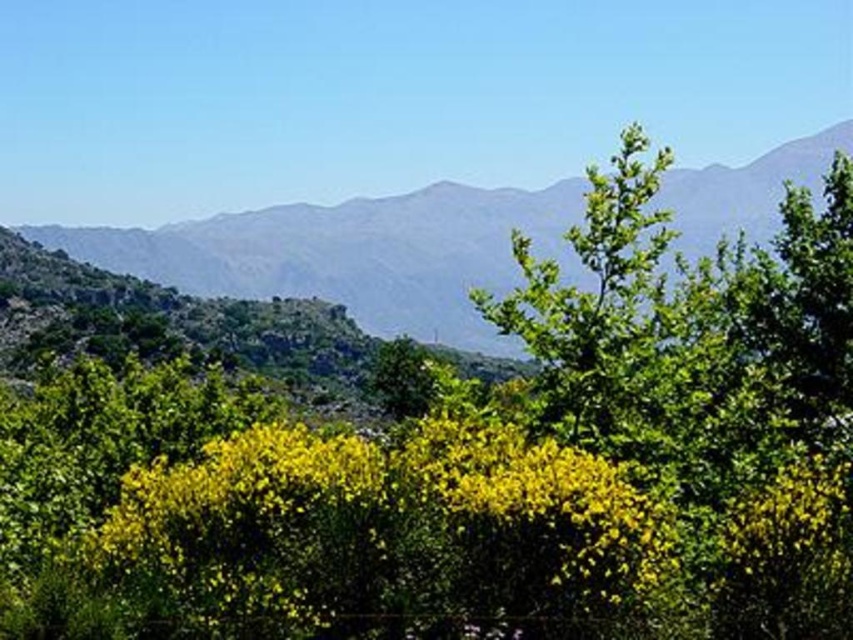
You are an environmental scientist observing this landscape. You notice the green textured mountain at center and the green leafy tree at center. Based on their positions, which one is closer to the sky?

The green textured mountain at center is located above the green leafy tree at center, so it is closer to the sky.

You are a hiker standing at the base of the green textured mountain at center. You want to reach the summit. Based on the information provided, can you estimate how far you need to hike to reach the summit?

The distance between you and the green textured mountain at center is 36.13 meters, so you need to hike approximately 36.13 meters to reach the summit.